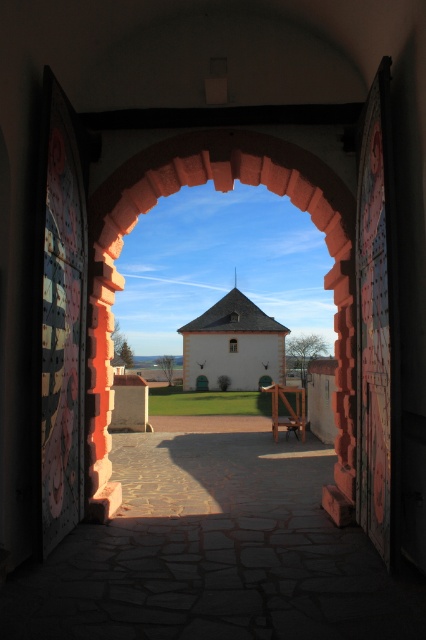
You are standing in the courtyard and want to take a photo of the white smooth stone chapel at center and the clear glass window at center. Which object will appear larger in your photo?

The white smooth stone chapel at center will appear larger in the photo because it is much taller than the clear glass window at center.

You are a visitor standing in front of the open brick stone archway at center and the white smooth stone chapel at center. Which structure appears larger from your perspective?

The white smooth stone chapel at center appears larger than the brick stone archway at center from your perspective because the brick stone archway at center is smaller than the white smooth stone chapel at center.

You are standing in the courtyard and want to look through the clear glass window at center to see the view outside. Which side of the brick stone archway at center should you stand on to have an unobstructed view?

You should stand on the right side of the brick stone archway at center to have an unobstructed view through the clear glass window at center since the brick stone archway at center is positioned on the left side of the clear glass window at center.